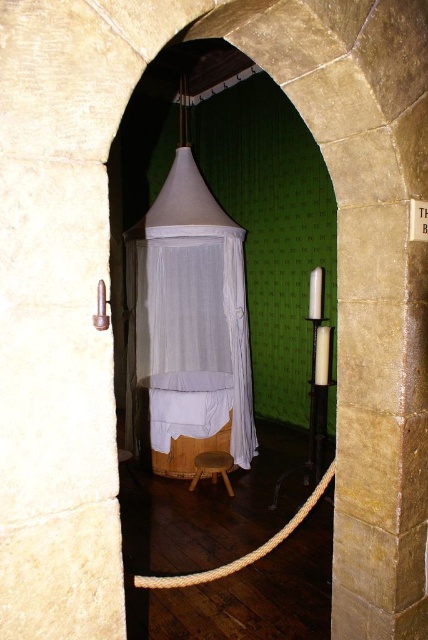
Which of these two, white fabric canopy bed at center or light brown wooden stool at center, stands taller?

white fabric canopy bed at center

The image size is (428, 640). Describe the element at coordinates (189, 317) in the screenshot. I see `white fabric canopy bed at center` at that location.

This screenshot has width=428, height=640. I want to click on white fabric canopy bed at center, so click(189, 317).

From the picture: Does white fabric canopy bed at center have a greater height compared to white rope at center?

Indeed, white fabric canopy bed at center has a greater height compared to white rope at center.

Where is `white fabric canopy bed at center`? Image resolution: width=428 pixels, height=640 pixels. white fabric canopy bed at center is located at coordinates (189, 317).

Who is more forward, [139,336] or [302,509]?

Point [302,509]

The image size is (428, 640). I want to click on white fabric canopy bed at center, so 189,317.

How far apart are white rope at center and light brown wooden stool at center?

white rope at center is 1.67 meters away from light brown wooden stool at center.

Is white rope at center thinner than light brown wooden stool at center?

In fact, white rope at center might be wider than light brown wooden stool at center.

Which is in front, point (193, 579) or point (222, 456)?

Point (193, 579)

Image resolution: width=428 pixels, height=640 pixels. What are the coordinates of `white rope at center` in the screenshot? It's located at (243, 556).